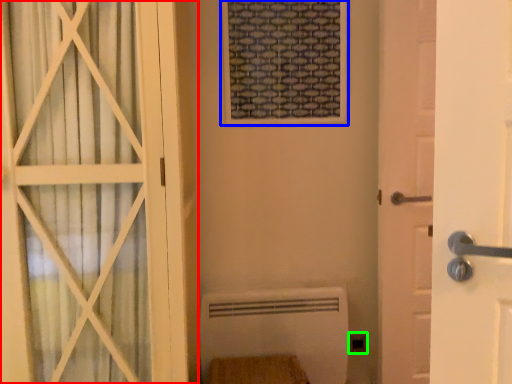
Question: Based on their relative distances, which object is farther from door (highlighted by a red box)? Choose from window frame (highlighted by a blue box) and electric outlet (highlighted by a green box).

Choices:
 (A) window frame
 (B) electric outlet

Answer: (B)